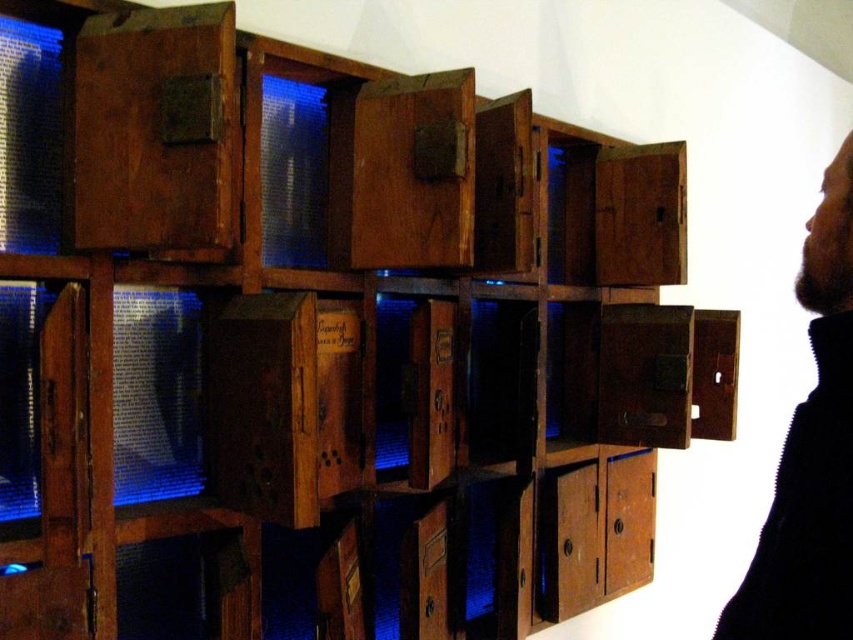
Question: Which of the following is the farthest from the observer?

Choices:
 (A) (833, 540)
 (B) (538, 570)

Answer: (B)

Question: Which point is farther to the camera?

Choices:
 (A) bearded black sweater at right
 (B) rustic wood drawer at lower right

Answer: (B)

Question: Is bearded black sweater at right smaller than rustic wood drawer at lower right?

Choices:
 (A) no
 (B) yes

Answer: (B)

Question: Does bearded black sweater at right appear on the right side of rustic wood drawer at lower right?

Choices:
 (A) yes
 (B) no

Answer: (B)

Question: Does bearded black sweater at right have a greater width compared to rustic wood drawer at lower right?

Choices:
 (A) no
 (B) yes

Answer: (A)